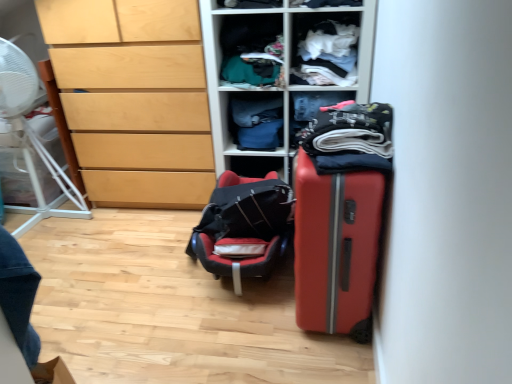
Measure the distance between textured green fabric at upper center, acting as the 3th clothing starting from the back, and camera.

They are 6.75 feet apart.

What do you see at coordinates (251, 49) in the screenshot? I see `textured green fabric at upper center, acting as the 3th clothing starting from the back` at bounding box center [251, 49].

In order to face white plastic fan at left, should I rotate leftwards or rightwards?

Turn left approximately 29.209 degrees to face it.

How much space does dark blue cotton shirt at center, the 5th clothing when ordered from back to front, occupy horizontally?

dark blue cotton shirt at center, the 5th clothing when ordered from back to front, is 11.70 inches wide.

You are a GUI agent. You are given a task and a screenshot of the screen. Output one action in this format:
    pyautogui.click(x=<x>, y=<y>)
    Task: Click on the dark blue cotton shirt at center, positioned as the 1th clothing in front-to-back order
    The image size is (512, 384).
    Given the screenshot: What is the action you would take?
    pyautogui.click(x=350, y=138)

What do you see at coordinates (336, 248) in the screenshot? I see `matte orange suitcase at right` at bounding box center [336, 248].

Image resolution: width=512 pixels, height=384 pixels. What do you see at coordinates (283, 66) in the screenshot?
I see `matte plastic shelving unit at center` at bounding box center [283, 66].

You are a GUI agent. You are given a task and a screenshot of the screen. Output one action in this format:
    pyautogui.click(x=<x>, y=<y>)
    Task: Click on the white cotton shirt at upper center, which is counted as the second clothing, starting from the front
    
    Given the screenshot: What is the action you would take?
    pyautogui.click(x=328, y=54)

What is the approximate width of white cotton shirt at upper center, which is counted as the second clothing, starting from the front?

11.70 inches.

What do you see at coordinates (131, 82) in the screenshot? I see `light wood chest of drawers at left` at bounding box center [131, 82].

The width and height of the screenshot is (512, 384). I want to click on black fabric backpack at center, so click(243, 227).

Could you measure the distance between dark blue cotton shirt at center, the 5th clothing when ordered from back to front, and black fabric backpack at center?

dark blue cotton shirt at center, the 5th clothing when ordered from back to front, and black fabric backpack at center are 22.44 inches apart from each other.

Which of these two, dark blue cotton shirt at center, the 5th clothing when ordered from back to front, or black fabric backpack at center, is wider?

With larger width is black fabric backpack at center.

Which of these two, dark blue cotton shirt at center, the 5th clothing when ordered from back to front, or black fabric backpack at center, is bigger?

Bigger between the two is black fabric backpack at center.

Locate an element on the screen. the 3rd clothing counting from the right side of the black fabric backpack at center is located at coordinates (350, 138).

Is matte orange suitcase at right positioned beyond the bounds of dark blue fabric at center, which appears as the fourth clothing when viewed from the front?

Yes, matte orange suitcase at right is located beyond the bounds of dark blue fabric at center, which appears as the fourth clothing when viewed from the front.

Where is `clothing that is the 2nd object located above the matte orange suitcase at right (from the image's perspective)`? The height and width of the screenshot is (384, 512). clothing that is the 2nd object located above the matte orange suitcase at right (from the image's perspective) is located at coordinates (311, 108).

Does matte orange suitcase at right appear on the right side of dark blue fabric at center, which ranks as the 2th clothing in back-to-front order?

No.

Is matte orange suitcase at right turned away from dark blue fabric at center, which appears as the fourth clothing when viewed from the front?

matte orange suitcase at right is not turned away from dark blue fabric at center, which appears as the fourth clothing when viewed from the front.

Can you see matte orange suitcase at right touching white plastic fan at left?

There is a gap between matte orange suitcase at right and white plastic fan at left.

Considering the relative positions of matte orange suitcase at right and white plastic fan at left in the image provided, is matte orange suitcase at right to the left of white plastic fan at left from the viewer's perspective?

In fact, matte orange suitcase at right is to the right of white plastic fan at left.

Is matte orange suitcase at right in front of white plastic fan at left?

Yes, it is in front of white plastic fan at left.

From the image's perspective, is matte orange suitcase at right positioned above or below white plastic fan at left?

matte orange suitcase at right is situated lower than white plastic fan at left in the image.

From a real-world perspective, relative to dark blue cotton shirt at center, the 5th clothing when ordered from back to front, is dark blue fabric at center, which appears as the fourth clothing when viewed from the front, vertically above or below?

dark blue fabric at center, which appears as the fourth clothing when viewed from the front, is situated lower than dark blue cotton shirt at center, the 5th clothing when ordered from back to front, in the real world.

Considering the points (295, 116) and (375, 153), which point is behind, point (295, 116) or point (375, 153)?

The point (295, 116) is behind.

Is dark blue fabric at center, which ranks as the 2th clothing in back-to-front order, to the left or to the right of dark blue cotton shirt at center, positioned as the 1th clothing in front-to-back order, in the image?

Based on their positions, dark blue fabric at center, which ranks as the 2th clothing in back-to-front order, is located to the right of dark blue cotton shirt at center, positioned as the 1th clothing in front-to-back order.

Do you think dark blue fabric at center, which ranks as the 2th clothing in back-to-front order, is within dark blue cotton shirt at center, positioned as the 1th clothing in front-to-back order, or outside of it?

The correct answer is: outside.

In the image, is white plastic fan at left on the left side or the right side of white cotton shirt at upper center, which is counted as the second clothing, starting from the front?

In the image, white plastic fan at left appears on the left side of white cotton shirt at upper center, which is counted as the second clothing, starting from the front.

Considering the sizes of white plastic fan at left and white cotton shirt at upper center, which is counted as the second clothing, starting from the front, in the image, is white plastic fan at left bigger or smaller than white cotton shirt at upper center, which is counted as the second clothing, starting from the front,?

In the image, white plastic fan at left appears to be larger than white cotton shirt at upper center, which is counted as the second clothing, starting from the front.

Based on the photo, are white plastic fan at left and white cotton shirt at upper center, which ranks as the 4th clothing in back-to-front order, making contact?

They are not placed beside each other.

Is white plastic fan at left not within white cotton shirt at upper center, which ranks as the 4th clothing in back-to-front order?

Yes.

Which clothing is the 2nd one when counting from the front of the denim fabric pants at center, the fifth clothing positioned from the front? Please provide its 2D coordinates.

[(251, 49)]

Consider the image. Can you confirm if denim fabric pants at center, positioned as the first clothing in back-to-front order, is shorter than textured green fabric at upper center, arranged as the 3th clothing when viewed from the front?

Incorrect, the height of denim fabric pants at center, positioned as the first clothing in back-to-front order, does not fall short of that of textured green fabric at upper center, arranged as the 3th clothing when viewed from the front.

From the picture: How different are the orientations of denim fabric pants at center, positioned as the first clothing in back-to-front order, and textured green fabric at upper center, acting as the 3th clothing starting from the back, in degrees?

The angle between the facing direction of denim fabric pants at center, positioned as the first clothing in back-to-front order, and the facing direction of textured green fabric at upper center, acting as the 3th clothing starting from the back, is 4.52 degrees.

Is textured green fabric at upper center, arranged as the 3th clothing when viewed from the front, at the back of denim fabric pants at center, positioned as the first clothing in back-to-front order?

That's not correct — denim fabric pants at center, positioned as the first clothing in back-to-front order, is not looking away from textured green fabric at upper center, arranged as the 3th clothing when viewed from the front.

Is light wood chest of drawers at left bigger or smaller than textured green fabric at upper center, acting as the 3th clothing starting from the back?

light wood chest of drawers at left is bigger than textured green fabric at upper center, acting as the 3th clothing starting from the back.

From the image's perspective, is light wood chest of drawers at left above or below textured green fabric at upper center, arranged as the 3th clothing when viewed from the front?

light wood chest of drawers at left is below textured green fabric at upper center, arranged as the 3th clothing when viewed from the front.

In the scene shown: Considering the sizes of light wood chest of drawers at left and textured green fabric at upper center, arranged as the 3th clothing when viewed from the front, in the image, is light wood chest of drawers at left wider or thinner than textured green fabric at upper center, arranged as the 3th clothing when viewed from the front,?

Clearly, light wood chest of drawers at left has more width compared to textured green fabric at upper center, arranged as the 3th clothing when viewed from the front.

Where is `luggage that appears on the left of dark blue cotton shirt at center, the 5th clothing when ordered from back to front`? luggage that appears on the left of dark blue cotton shirt at center, the 5th clothing when ordered from back to front is located at coordinates click(243, 227).

Image resolution: width=512 pixels, height=384 pixels. Find the location of `the 1st clothing directly above the matte orange suitcase at right (from a real-world perspective)`. the 1st clothing directly above the matte orange suitcase at right (from a real-world perspective) is located at coordinates (311, 108).

Considering their positions, is dark blue cotton shirt at center, positioned as the 1th clothing in front-to-back order, positioned further to white cotton shirt at upper center, which is counted as the second clothing, starting from the front, than black fabric backpack at center?

black fabric backpack at center is further to white cotton shirt at upper center, which is counted as the second clothing, starting from the front.

Looking at this image, based on their spatial positions, is black fabric backpack at center or dark blue cotton shirt at center, the 5th clothing when ordered from back to front, further from textured green fabric at upper center, arranged as the 3th clothing when viewed from the front?

dark blue cotton shirt at center, the 5th clothing when ordered from back to front, is further to textured green fabric at upper center, arranged as the 3th clothing when viewed from the front.

Which object lies further to the anchor point matte plastic shelving unit at center, dark blue fabric at center, which ranks as the 2th clothing in back-to-front order, or dark blue cotton shirt at center, positioned as the 1th clothing in front-to-back order?

dark blue cotton shirt at center, positioned as the 1th clothing in front-to-back order, is further to matte plastic shelving unit at center.

From the image, which object appears to be nearer to dark blue fabric at center, which appears as the fourth clothing when viewed from the front, matte orange suitcase at right or textured green fabric at upper center, arranged as the 3th clothing when viewed from the front?

textured green fabric at upper center, arranged as the 3th clothing when viewed from the front, is closer to dark blue fabric at center, which appears as the fourth clothing when viewed from the front.

Which object lies further to the anchor point matte orange suitcase at right, matte plastic shelving unit at center or dark blue cotton shirt at center, the 5th clothing when ordered from back to front?

Based on the image, matte plastic shelving unit at center appears to be further to matte orange suitcase at right.

Which object lies nearer to the anchor point light wood chest of drawers at left, matte plastic shelving unit at center or dark blue cotton shirt at center, the 5th clothing when ordered from back to front?

Among the two, matte plastic shelving unit at center is located nearer to light wood chest of drawers at left.

Looking at the image, which one is located closer to white cotton shirt at upper center, which is counted as the second clothing, starting from the front, textured green fabric at upper center, acting as the 3th clothing starting from the back, or black fabric backpack at center?

Based on the image, textured green fabric at upper center, acting as the 3th clothing starting from the back, appears to be nearer to white cotton shirt at upper center, which is counted as the second clothing, starting from the front.

When comparing their distances from white cotton shirt at upper center, which ranks as the 4th clothing in back-to-front order, does matte plastic shelving unit at center or textured green fabric at upper center, arranged as the 3th clothing when viewed from the front, seem closer?

Based on the image, matte plastic shelving unit at center appears to be nearer to white cotton shirt at upper center, which ranks as the 4th clothing in back-to-front order.

This screenshot has height=384, width=512. I want to click on luggage between light wood chest of drawers at left and matte plastic shelving unit at center from left to right, so click(x=243, y=227).

Identify the location of suitcase located between white plastic fan at left and white cotton shirt at upper center, which ranks as the 4th clothing in back-to-front order, in the left-right direction. Image resolution: width=512 pixels, height=384 pixels. (336, 248).

The width and height of the screenshot is (512, 384). I want to click on the chest of drawers located between white plastic fan at left and matte plastic shelving unit at center in the left-right direction, so click(131, 82).

Identify the location of luggage between white plastic fan at left and denim fabric pants at center, positioned as the first clothing in back-to-front order, from left to right. Image resolution: width=512 pixels, height=384 pixels. (243, 227).